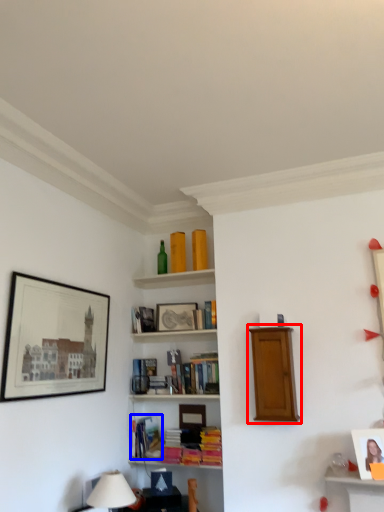
Question: Which object appears farthest to the camera in this image, shelf (highlighted by a red box) or book (highlighted by a blue box)?

Choices:
 (A) shelf
 (B) book

Answer: (B)